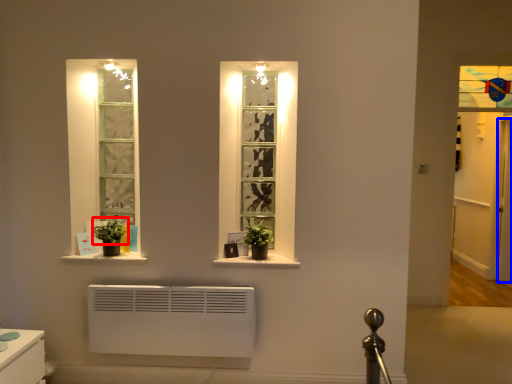
Question: Which of the following is the closest to the observer, plant (highlighted by a red box) or door (highlighted by a blue box)?

Choices:
 (A) plant
 (B) door

Answer: (A)